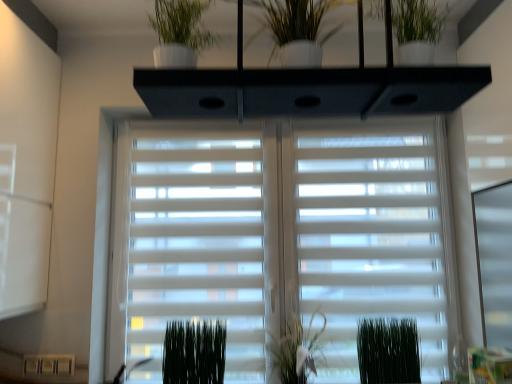
Question: Considering their positions, is green matte plant at lower right, the first plant in the right-to-left sequence, located in front of or behind white glossy vase at upper center?

Choices:
 (A) behind
 (B) front

Answer: (A)

Question: From a real-world perspective, is green matte plant at lower right, the first plant in the right-to-left sequence, positioned above or below white glossy vase at upper center?

Choices:
 (A) above
 (B) below

Answer: (B)

Question: Which is nearer to the green matte plant at center, which appears as the 2th plant when viewed from the left?

Choices:
 (A) white matte window blind at center
 (B) white glossy vase at upper center
 (C) green matte plant at lower center, which is counted as the 3th plant, starting from the right
 (D) green matte plant at lower right, the third plant positioned from the left

Answer: (D)

Question: Estimate the real-world distances between objects in this image. Which object is farther from the green matte plant at lower center, which is counted as the 3th plant, starting from the right?

Choices:
 (A) white matte window blind at center
 (B) green matte plant at lower right, the first plant in the right-to-left sequence
 (C) green matte plant at center, which appears as the 2th plant when viewed from the left
 (D) white glossy vase at upper center

Answer: (D)